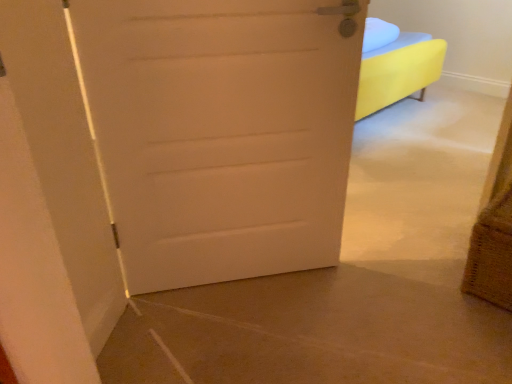
The height and width of the screenshot is (384, 512). What do you see at coordinates (490, 253) in the screenshot? I see `burlap basket at lower right` at bounding box center [490, 253].

Find the location of a particular element. This screenshot has height=384, width=512. burlap basket at lower right is located at coordinates (490, 253).

Measure the distance between point (499, 288) and camera.

4.88 feet.

What are the coordinates of `white matte door at center` in the screenshot? It's located at (220, 132).

Describe the element at coordinates (220, 132) in the screenshot. I see `white matte door at center` at that location.

From the picture: Measure the distance between point [174,50] and camera.

3.95 feet.

The width and height of the screenshot is (512, 384). Find the location of `burlap basket at lower right`. burlap basket at lower right is located at coordinates (490, 253).

Between burlap basket at lower right and white matte door at center, which one appears on the right side from the viewer's perspective?

Positioned to the right is burlap basket at lower right.

Who is more distant, burlap basket at lower right or white matte door at center?

burlap basket at lower right is behind.

Which is behind, point (468, 267) or point (213, 133)?

The point (468, 267) is more distant.

From the image's perspective, is burlap basket at lower right above or below white matte door at center?

From the image's perspective, burlap basket at lower right appears below white matte door at center.

From a real-world perspective, between burlap basket at lower right and white matte door at center, who is vertically higher?

white matte door at center, from a real-world perspective.

Is burlap basket at lower right wider or thinner than white matte door at center?

In the image, burlap basket at lower right appears to be wider than white matte door at center.

Is burlap basket at lower right taller than white matte door at center?

No.

Considering the sizes of objects burlap basket at lower right and white matte door at center in the image provided, who is bigger, burlap basket at lower right or white matte door at center?

white matte door at center.

Does burlap basket at lower right contain white matte door at center?

Definitely not — white matte door at center is not inside burlap basket at lower right.

Can you see burlap basket at lower right touching white matte door at center?

No.

Is burlap basket at lower right oriented towards white matte door at center?

No, burlap basket at lower right does not turn towards white matte door at center.

How distant is burlap basket at lower right from white matte door at center?

The distance of burlap basket at lower right from white matte door at center is 80.71 centimeters.

Find the location of a particular element. The width and height of the screenshot is (512, 384). basket below the white matte door at center (from the image's perspective) is located at coordinates (490, 253).

From the picture: Which is more to the right, white matte door at center or burlap basket at lower right?

burlap basket at lower right.

Relative to burlap basket at lower right, is white matte door at center in front or behind?

Clearly, white matte door at center is in front of burlap basket at lower right.

Which is farther from the camera, [186,16] or [470,282]?

The point [470,282] is farther from the camera.

From the image's perspective, is white matte door at center above or below burlap basket at lower right?

Based on their image positions, white matte door at center is located above burlap basket at lower right.

From a real-world perspective, between white matte door at center and burlap basket at lower right, who is vertically lower?

burlap basket at lower right.

Can you confirm if white matte door at center is wider than burlap basket at lower right?

In fact, white matte door at center might be narrower than burlap basket at lower right.

Can you confirm if white matte door at center is taller than burlap basket at lower right?

Correct, white matte door at center is much taller as burlap basket at lower right.

In terms of size, does white matte door at center appear bigger or smaller than burlap basket at lower right?

In the image, white matte door at center appears to be larger than burlap basket at lower right.

Is burlap basket at lower right completely or partially inside white matte door at center?

No.

Are white matte door at center and burlap basket at lower right far apart?

No, white matte door at center is not far from burlap basket at lower right.

Is burlap basket at lower right at the back of white matte door at center?

No, white matte door at center is not facing the opposite direction of burlap basket at lower right.

How different are the orientations of white matte door at center and burlap basket at lower right in degrees?

They differ by 31 degrees in their facing directions.

Identify the location of basket on the right side of white matte door at center. This screenshot has width=512, height=384. (490, 253).

The image size is (512, 384). In order to click on door on the left of the burlap basket at lower right in this screenshot , I will do `click(220, 132)`.

The height and width of the screenshot is (384, 512). I want to click on basket located underneath the white matte door at center (from a real-world perspective), so coord(490,253).